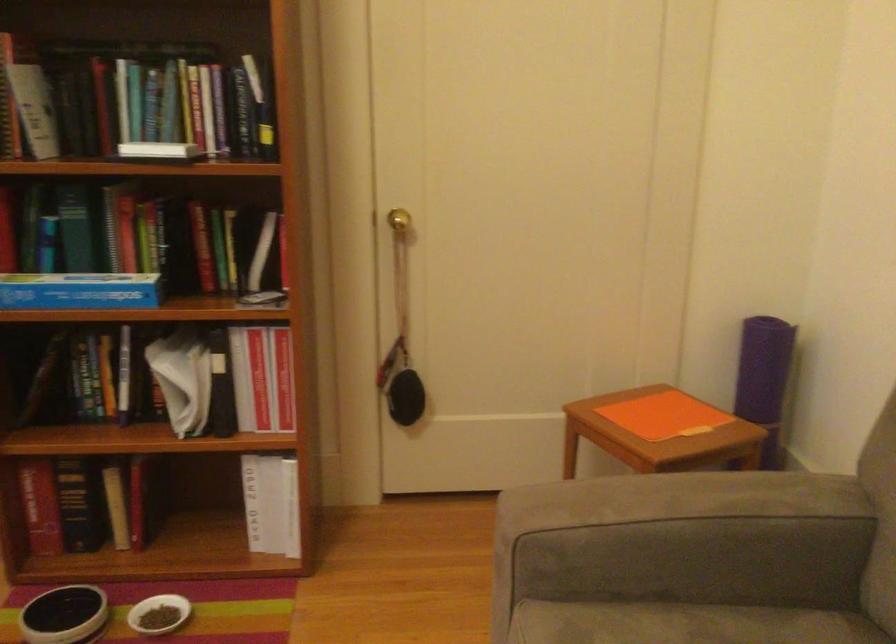
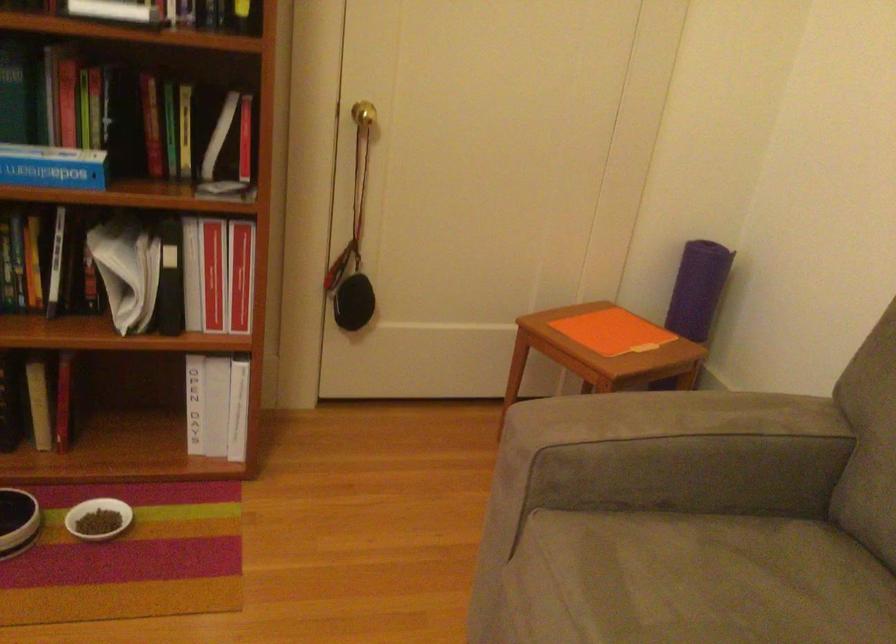
Where in the second image is the point corresponding to the point at 757,366 from the first image?

(698, 289)